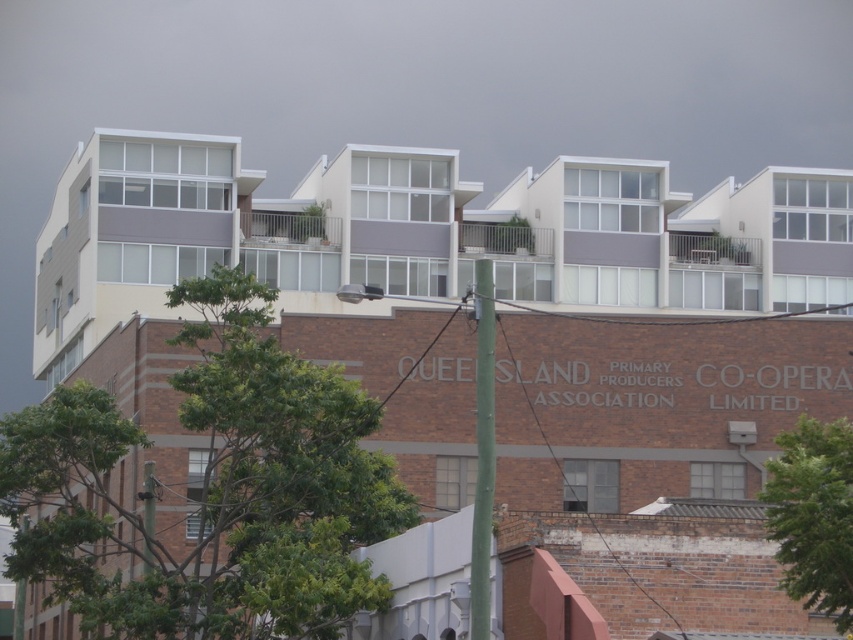
Question: Which point appears closest to the camera in this image?

Choices:
 (A) pyautogui.click(x=479, y=442)
 (B) pyautogui.click(x=830, y=580)

Answer: (B)

Question: Considering the relative positions of green leafy tree at upper center and green leafy tree at lower right in the image provided, where is green leafy tree at upper center located with respect to green leafy tree at lower right?

Choices:
 (A) right
 (B) left

Answer: (B)

Question: Does green leafy tree at upper center have a larger size compared to green textured pole at center?

Choices:
 (A) yes
 (B) no

Answer: (A)

Question: Which point is closer to the camera?

Choices:
 (A) (473, 576)
 (B) (149, 621)
 (C) (844, 538)

Answer: (C)

Question: Is green leafy tree at lower right thinner than green textured pole at center?

Choices:
 (A) no
 (B) yes

Answer: (A)

Question: Which point is farther from the camera taking this photo?

Choices:
 (A) (839, 547)
 (B) (202, 516)

Answer: (B)